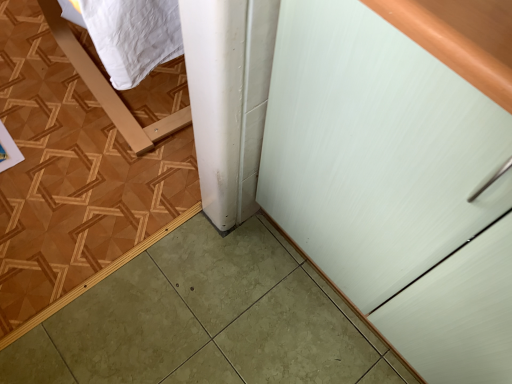
Question: From the image's perspective, is green glossy tile at lower left positioned above or below white matte cabinet at right?

Choices:
 (A) below
 (B) above

Answer: (B)

Question: Based on their positions, is green glossy tile at lower left located to the left or right of white matte cabinet at right?

Choices:
 (A) left
 (B) right

Answer: (A)

Question: Considering their positions, is green glossy tile at lower left located in front of or behind white matte cabinet at right?

Choices:
 (A) behind
 (B) front

Answer: (A)

Question: Visually, is white matte cabinet at right positioned to the left or to the right of green glossy tile at lower left?

Choices:
 (A) left
 (B) right

Answer: (B)

Question: Is point (287, 99) positioned closer to the camera than point (6, 34)?

Choices:
 (A) farther
 (B) closer

Answer: (B)

Question: Is white matte cabinet at right spatially inside green glossy tile at lower left, or outside of it?

Choices:
 (A) inside
 (B) outside

Answer: (B)

Question: From their relative heights in the image, would you say white matte cabinet at right is taller or shorter than green glossy tile at lower left?

Choices:
 (A) short
 (B) tall

Answer: (B)